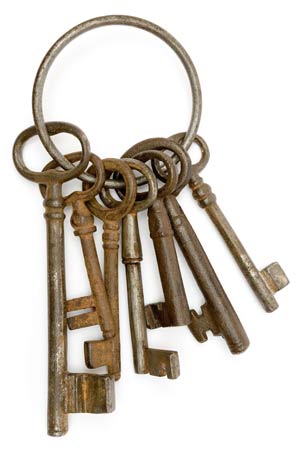
The width and height of the screenshot is (300, 450). Identify the location of keys. (55, 250), (89, 247), (105, 243), (130, 240), (165, 231), (181, 229), (211, 214).